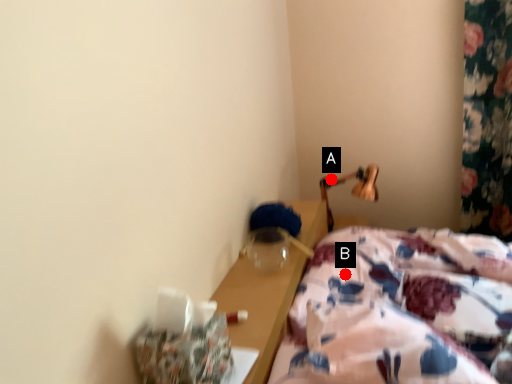
Question: Two points are circled on the image, labeled by A and B beside each circle. Which point is closer to the camera?

Choices:
 (A) A is closer
 (B) B is closer

Answer: (B)